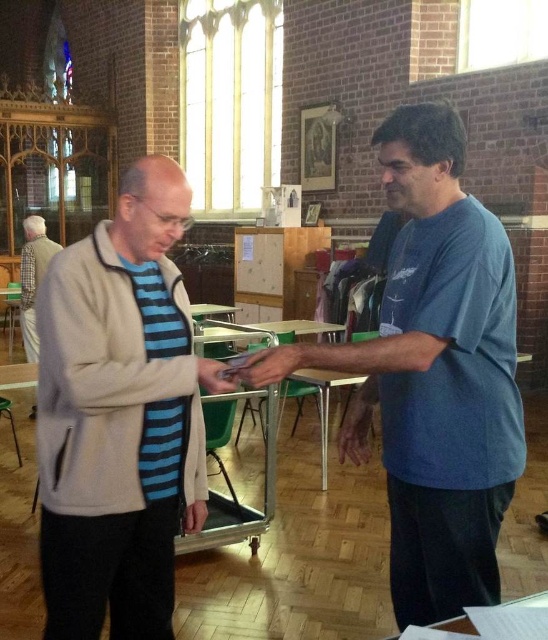
Is matte black phone at center further to camera compared to white glossy table at lower center?

Yes.

Who is positioned more to the right, matte black phone at center or white glossy table at lower center?

white glossy table at lower center is more to the right.

At what (x,y) coordinates should I click in order to perform the action: click on matte black phone at center. Please return your answer as a coordinate pair (x, y). The image size is (548, 640). Looking at the image, I should click on (214, 376).

Can you confirm if light beige fleece jacket at center is smaller than light brown sweater at left?

Yes.

Which of these two, light beige fleece jacket at center or light brown sweater at left, stands taller?

Standing taller between the two is light beige fleece jacket at center.

Locate an element on the screen. light beige fleece jacket at center is located at coordinates (118, 417).

Does blue cotton shirt at right have a lesser width compared to matte black hand at center?

Incorrect, blue cotton shirt at right's width is not less than matte black hand at center's.

Is the position of blue cotton shirt at right more distant than that of matte black hand at center?

That is False.

I want to click on blue cotton shirt at right, so click(441, 372).